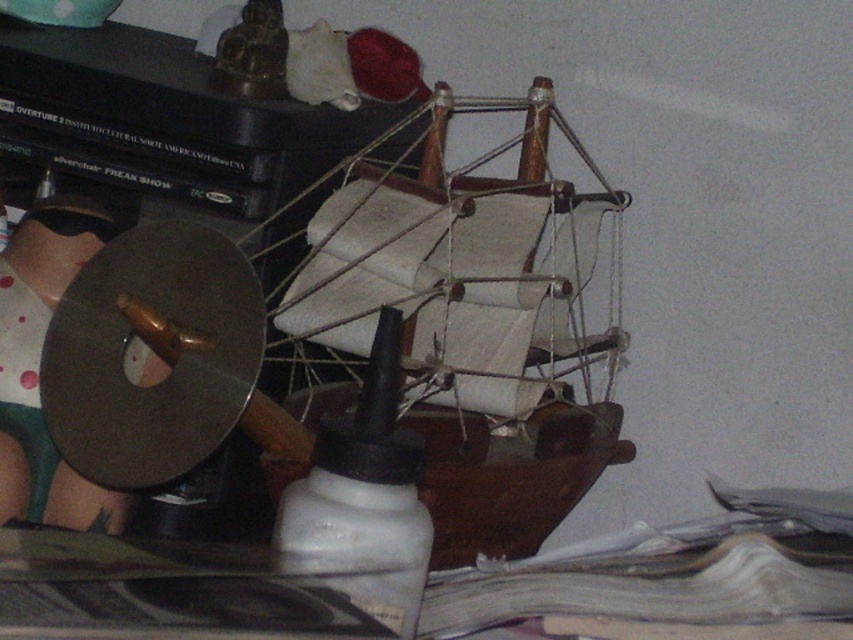
Question: Which of the following is the closest to the observer?

Choices:
 (A) matte black disc at left
 (B) white matte bottle at center

Answer: (B)

Question: Among these objects, which one is farthest from the camera?

Choices:
 (A) matte black disc at left
 (B) white matte bottle at center

Answer: (A)

Question: Observing the image, what is the correct spatial positioning of white matte bottle at center in reference to matte black disc at left?

Choices:
 (A) above
 (B) below

Answer: (B)

Question: Is white matte bottle at center closer to camera compared to matte black disc at left?

Choices:
 (A) no
 (B) yes

Answer: (B)

Question: Which object appears farthest from the camera in this image?

Choices:
 (A) matte black disc at left
 (B) white matte bottle at center

Answer: (A)

Question: Can you confirm if white matte bottle at center is positioned to the left of matte black disc at left?

Choices:
 (A) no
 (B) yes

Answer: (A)